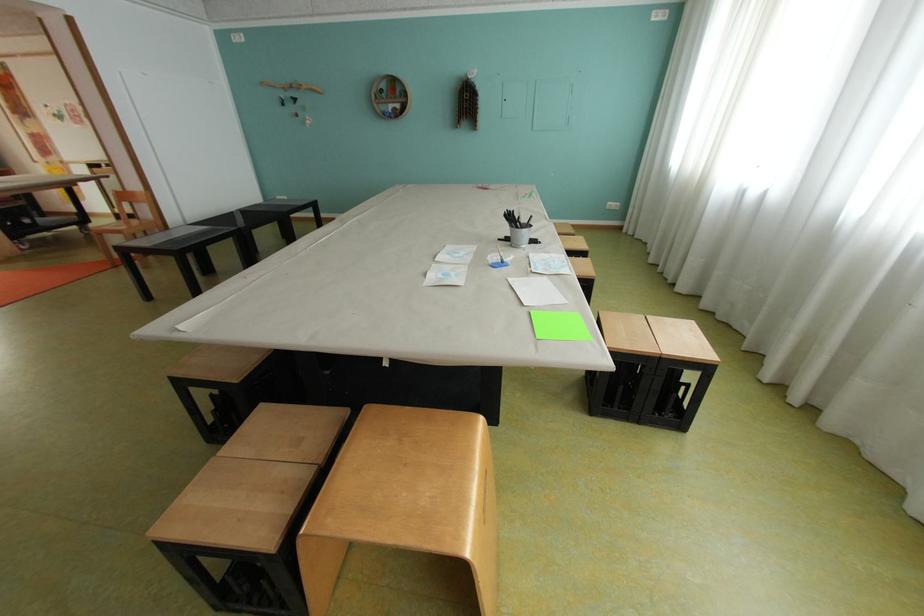
Where would you pull the wooden stool handle? Please return your answer as a coordinate pair (x, y).

(487, 505)